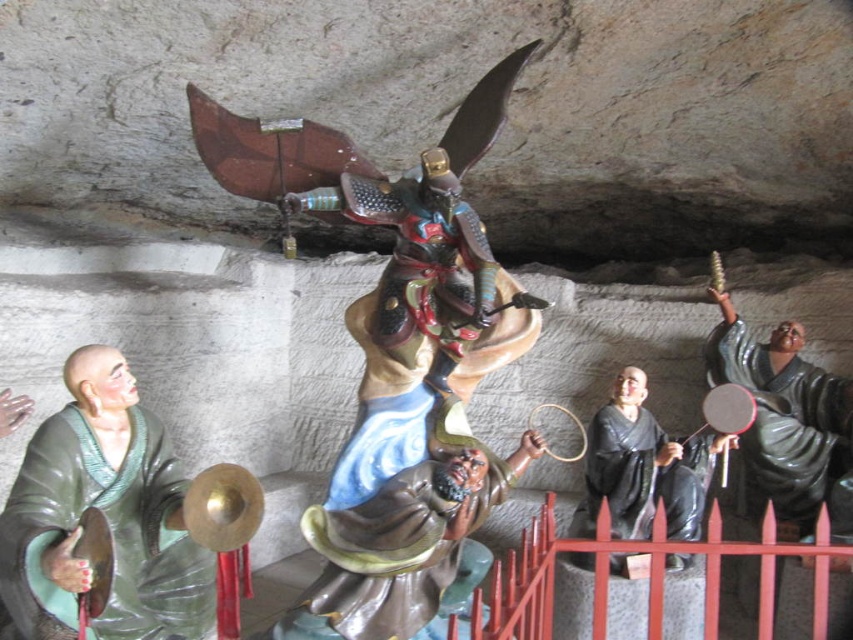
Question: Which of the following is the closest to the observer?

Choices:
 (A) green matte monk statue at left
 (B) black glossy monk at center

Answer: (A)

Question: Does smooth brown statue at center appear under black glossy monk at center?

Choices:
 (A) no
 (B) yes

Answer: (B)

Question: Is smooth brown statue at center below red metal fence at lower center?

Choices:
 (A) yes
 (B) no

Answer: (B)

Question: Which object appears farthest from the camera in this image?

Choices:
 (A) green matte monk statue at left
 (B) smooth brown statue at center
 (C) red metal fence at lower center
 (D) shiny bronze warrior at center

Answer: (B)

Question: Which object is positioned farthest from the red metal fence at lower center?

Choices:
 (A) smooth brown statue at center
 (B) shiny bronze warrior at center
 (C) green matte monk statue at left
 (D) black glossy monk at center

Answer: (C)

Question: Is green matte monk statue at left to the left of smooth brown statue at center from the viewer's perspective?

Choices:
 (A) yes
 (B) no

Answer: (A)